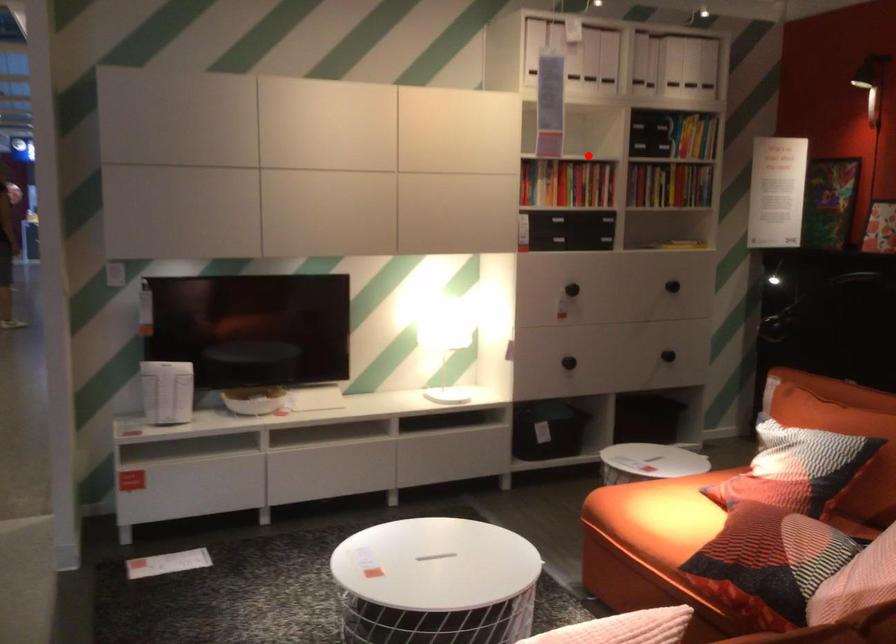
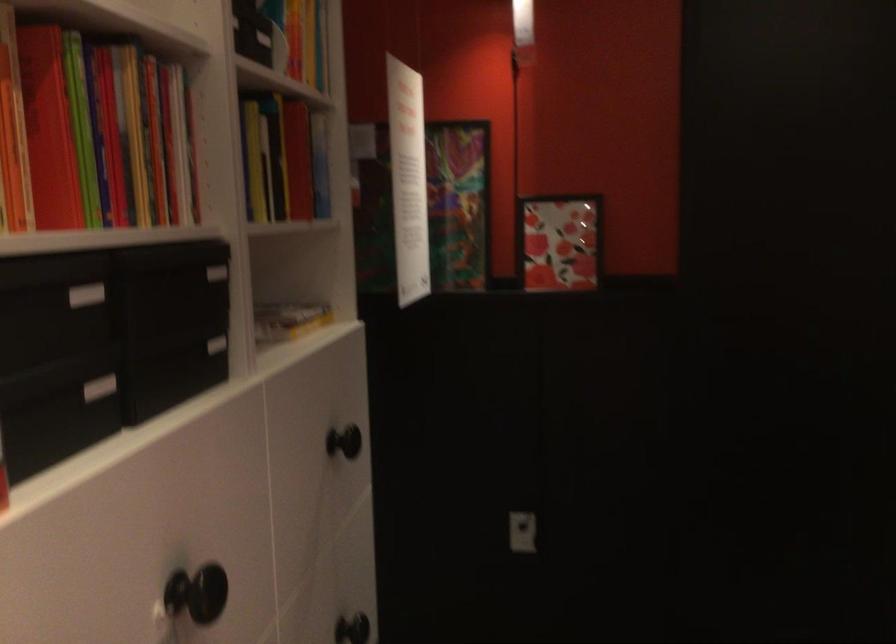
In the second image, find the point that corresponds to the highlighted location in the first image.

(99, 136)